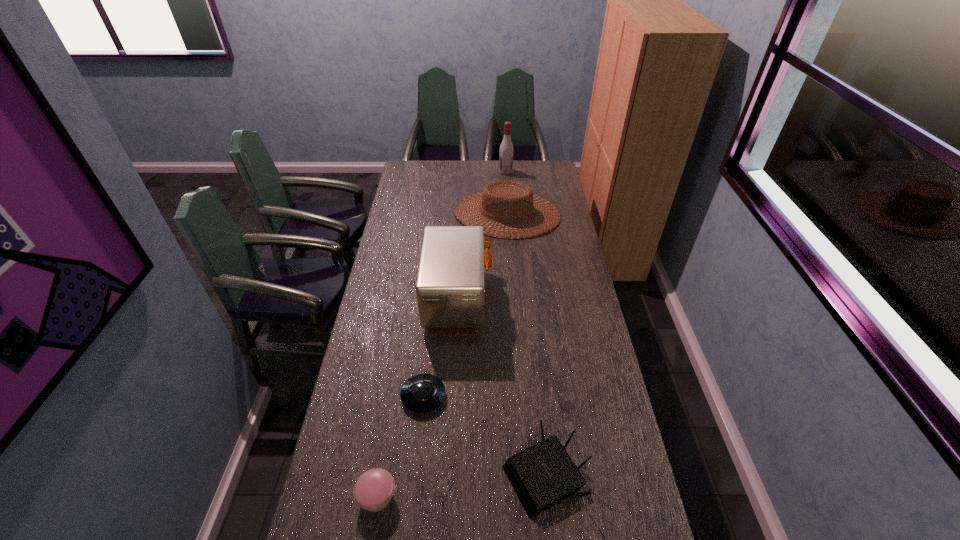
Find the location of a particular element. This screenshot has width=960, height=540. alcohol is located at coordinates (506, 150).

Image resolution: width=960 pixels, height=540 pixels. Find the location of `the farthest object`. the farthest object is located at coordinates (506, 150).

Where is `toaster oven`? toaster oven is located at coordinates (450, 289).

Where is `the second tallest object`? The image size is (960, 540). the second tallest object is located at coordinates (450, 289).

The image size is (960, 540). I want to click on sunhat, so click(489, 193).

In order to click on the third tallest object in this screenshot , I will do `click(489, 193)`.

Locate an element on the screen. the fourth tallest object is located at coordinates click(x=542, y=475).

Locate an element on the screen. The width and height of the screenshot is (960, 540). cupcake is located at coordinates (373, 490).

At what (x,y) coordinates should I click in order to perform the action: click on the third nearest object. Please return your answer as a coordinate pair (x, y). Looking at the image, I should click on (421, 393).

Image resolution: width=960 pixels, height=540 pixels. Identify the location of the shortest object. (421, 393).